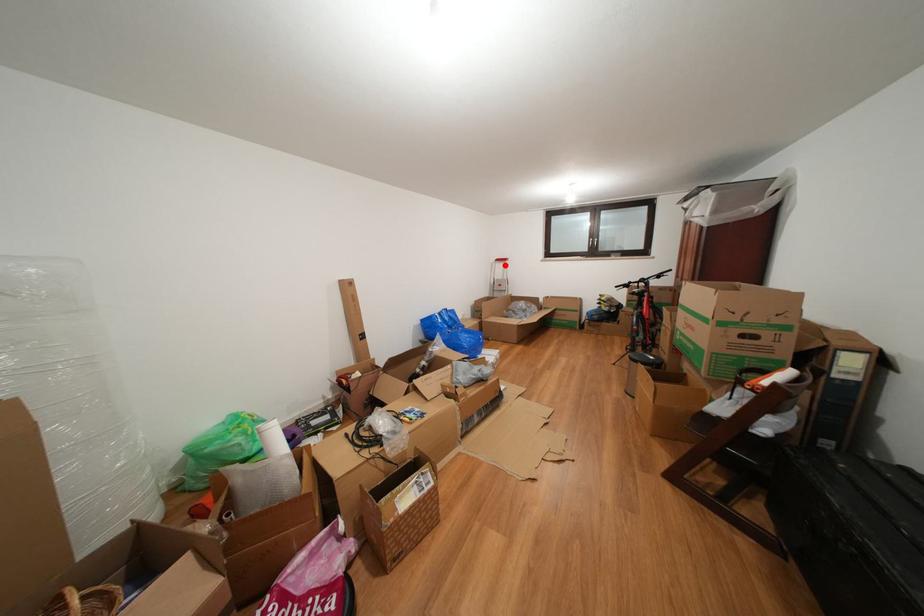
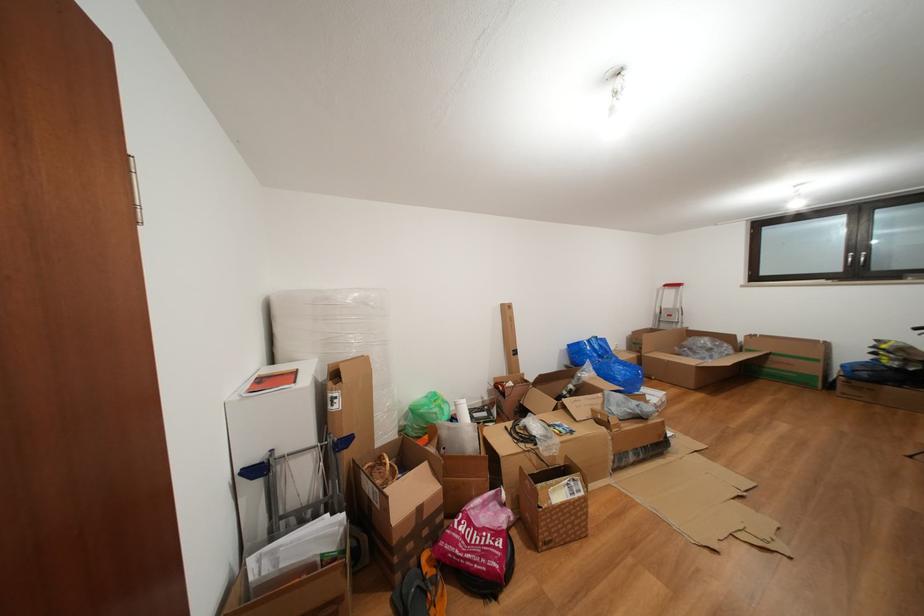
Question: A red point is marked in image1. In image2, is the corresponding 3D point closer to the camera or farther? Reply with the corresponding letter.

Choices:
 (A) The corresponding 3D point is closer.
 (B) The corresponding 3D point is farther.

Answer: (B)